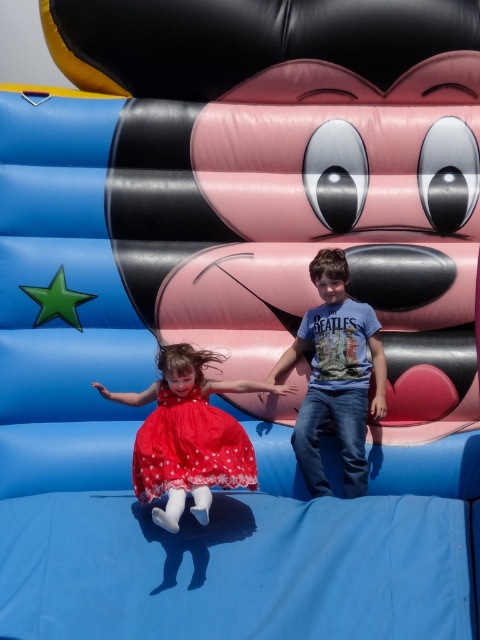
You are standing in front of the bouncy castle and want to reach the point at coordinates (x=314, y=264). The bouncy castle is 20 feet wide. Can you walk straight to that point without stepping outside the bouncy castle?

The point at coordinates (x=314, y=264) is 19.94 feet away from the viewer, which is within the 20 feet width of the bouncy castle. Therefore, you can walk straight to that point without stepping outside the bouncy castle.

You are standing at the center of the bouncy castle and want to reach the point at the bottom right corner. Which point, point 1 at coordinates (359, 493) or point 2 at (228, 474), is closer to your current position?

Point 2 at coordinates (228, 474) is closer to the center of the bouncy castle than point 1 at (359, 493), so you should go to point 2 at coordinates (228, 474) first.